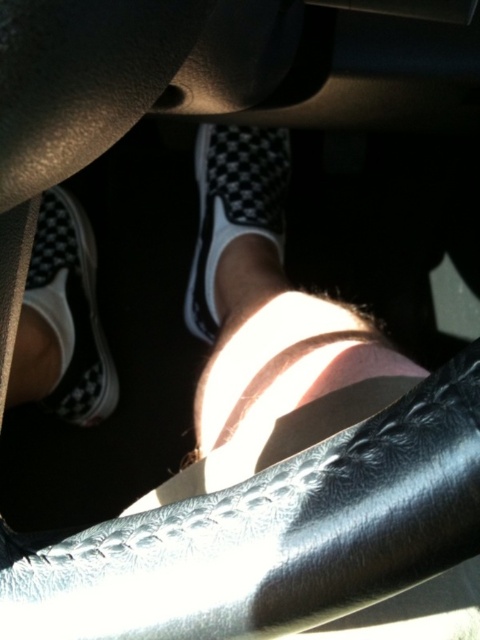
You are a delivery robot standing outside the car and need to place a package inside. The package is 1.2 meters long. Can you fit it between the checkerboard fabric shoe at lower left and the back of the car seat?

The distance between the checkerboard fabric shoe at lower left and the viewer is 1.12 meters, but the package is 1.2 meters long. Therefore, the package cannot fit in that space.